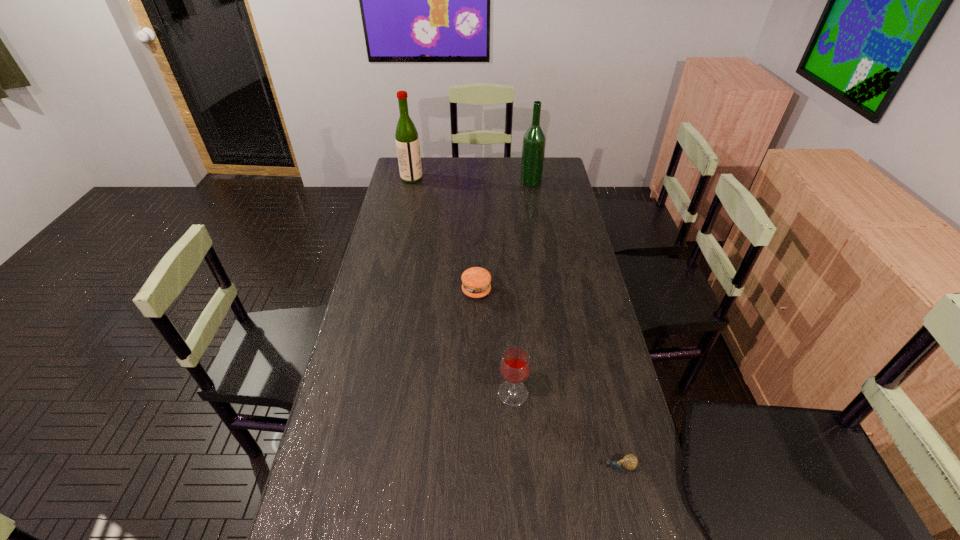
The height and width of the screenshot is (540, 960). I want to click on object located at the far left corner, so click(x=407, y=141).

Where is `object present at the far right corner`? object present at the far right corner is located at coordinates (534, 140).

Where is `free space at the left edge`? The image size is (960, 540). free space at the left edge is located at coordinates (396, 316).

Image resolution: width=960 pixels, height=540 pixels. I want to click on vacant region at the right edge of the desktop, so click(562, 300).

At what (x,y) coordinates should I click in order to perform the action: click on free space between the rightmost object and the third object from right to left. Please return your answer as a coordinate pair (x, y). Looking at the image, I should click on point(565,430).

Identify the location of vacant point located between the rightmost object and the fourth object from left to right. The width and height of the screenshot is (960, 540). click(575, 324).

Find the location of a particular element. The width and height of the screenshot is (960, 540). free space between the alcohol and the shortest object is located at coordinates (575, 324).

Find the location of a particular element. The width and height of the screenshot is (960, 540). blank region between the alcohol and the third object from right to left is located at coordinates (522, 287).

Where is `vacant area that lies between the wineglass and the alcohol`? Image resolution: width=960 pixels, height=540 pixels. vacant area that lies between the wineglass and the alcohol is located at coordinates (522, 287).

Find the location of a particular element. blank region between the nearest object and the fourth tallest object is located at coordinates (547, 379).